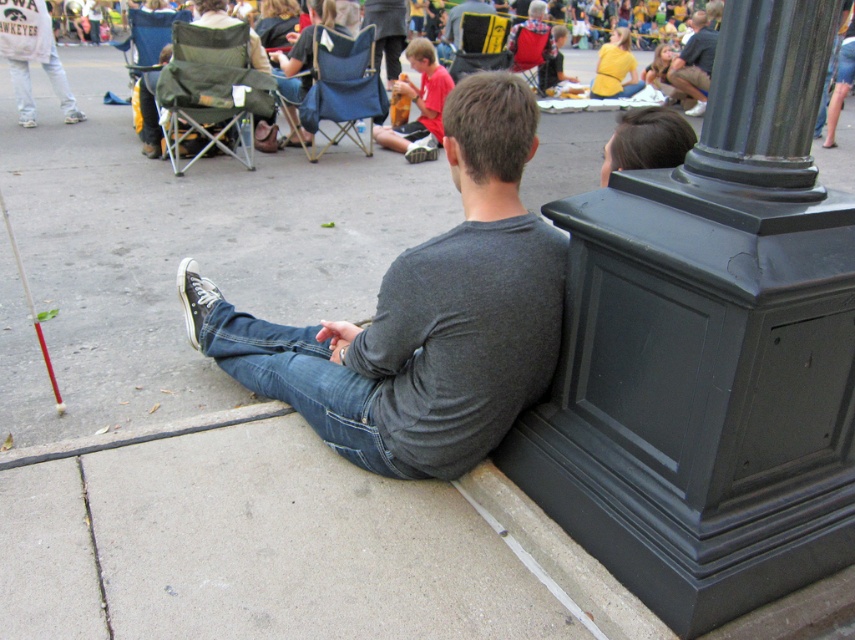
Question: Can you confirm if black polished column at upper right is smaller than green fabric folding chair at upper left?

Choices:
 (A) yes
 (B) no

Answer: (A)

Question: Which point is closer to the camera?

Choices:
 (A) yellow fabric chair at center
 (B) dark gray cotton shirt at center
 (C) matte red shorts at center
 (D) blue fabric chair at center

Answer: (B)

Question: Can you confirm if denim at lower center is wider than yellow fabric chair at center?

Choices:
 (A) no
 (B) yes

Answer: (B)

Question: Which is nearer to the dark gray shirt at center?

Choices:
 (A) blue fabric chair at center
 (B) denim at lower center
 (C) dark gray cotton shirt at center
 (D) green fabric folding chair at upper left

Answer: (A)

Question: Is black polished column at upper right positioned before denim at lower center?

Choices:
 (A) yes
 (B) no

Answer: (A)

Question: Which point is closer to the camera taking this photo?

Choices:
 (A) (413, 147)
 (B) (234, 108)
 (C) (276, 381)

Answer: (C)